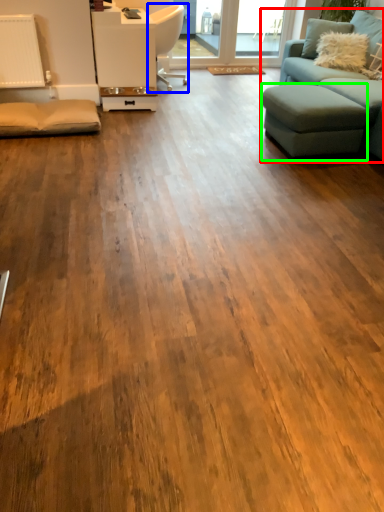
Question: Which is nearer to the studio couch (highlighted by a red box)? chair (highlighted by a blue box) or footrest (highlighted by a green box).

Choices:
 (A) chair
 (B) footrest

Answer: (B)